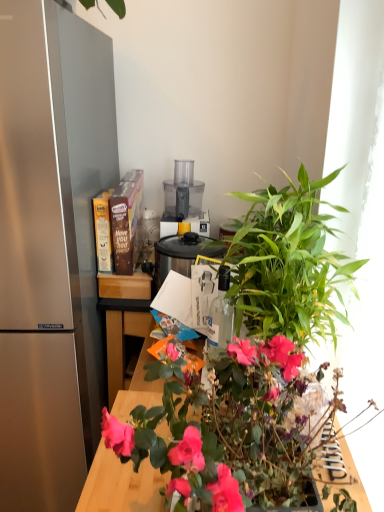
Image resolution: width=384 pixels, height=512 pixels. I want to click on satin silver blender at center, placed as the second appliance when sorted from bottom to top, so click(150, 227).

Describe the element at coordinates (181, 255) in the screenshot. I see `black plastic slow cooker at center, the 1th appliance when ordered from bottom to top` at that location.

Measure the distance between transparent glass bottle at center and camera.

The distance of transparent glass bottle at center from camera is 1.07 meters.

The height and width of the screenshot is (512, 384). What do you see at coordinates (183, 201) in the screenshot?
I see `transparent plastic food processor at center, the third appliance when ordered from bottom to top` at bounding box center [183, 201].

Find the location of `green leafy plant at center`. green leafy plant at center is located at coordinates (256, 355).

The height and width of the screenshot is (512, 384). Find the location of `satin silver blender at center, the 2th appliance from the top`. satin silver blender at center, the 2th appliance from the top is located at coordinates (150, 227).

Considering the positions of objects transparent glass bottle at center and black plastic slow cooker at center, the 1th appliance when ordered from bottom to top, in the image provided, who is more to the left, transparent glass bottle at center or black plastic slow cooker at center, the 1th appliance when ordered from bottom to top,?

From the viewer's perspective, black plastic slow cooker at center, the 1th appliance when ordered from bottom to top, appears more on the left side.

Would you say transparent glass bottle at center is a long distance from black plastic slow cooker at center, which is counted as the 3th appliance, starting from the top?

transparent glass bottle at center is actually quite close to black plastic slow cooker at center, which is counted as the 3th appliance, starting from the top.

Starting from the transparent glass bottle at center, which appliance is the 2nd one to the left? Please provide its 2D coordinates.

[(181, 255)]

From the picture: From the image's perspective, is transparent glass bottle at center beneath black plastic slow cooker at center, which is counted as the 3th appliance, starting from the top?

Yes, from the image's perspective, transparent glass bottle at center is beneath black plastic slow cooker at center, which is counted as the 3th appliance, starting from the top.

From the image's perspective, relative to black plastic slow cooker at center, which is counted as the 3th appliance, starting from the top, is satin silver refrigerator at left above or below?

satin silver refrigerator at left is below black plastic slow cooker at center, which is counted as the 3th appliance, starting from the top.

Is satin silver refrigerator at left closer to the viewer compared to black plastic slow cooker at center, the 1th appliance when ordered from bottom to top?

Yes, satin silver refrigerator at left is closer to the camera.

Is satin silver refrigerator at left positioned far away from black plastic slow cooker at center, which is counted as the 3th appliance, starting from the top?

No.

Between point (11, 57) and point (181, 260), which one is positioned behind?

The point (181, 260) is farther.

Is black plastic slow cooker at center, the 1th appliance when ordered from bottom to top, taller than satin silver blender at center, the 2th appliance from the top?

Yes.

From a real-world perspective, is black plastic slow cooker at center, the 1th appliance when ordered from bottom to top, below satin silver blender at center, placed as the second appliance when sorted from bottom to top?

Indeed, from a real-world perspective, black plastic slow cooker at center, the 1th appliance when ordered from bottom to top, is positioned beneath satin silver blender at center, placed as the second appliance when sorted from bottom to top.

Between black plastic slow cooker at center, the 1th appliance when ordered from bottom to top, and satin silver blender at center, placed as the second appliance when sorted from bottom to top, which one appears on the right side from the viewer's perspective?

black plastic slow cooker at center, the 1th appliance when ordered from bottom to top, is more to the right.

Is satin silver blender at center, the 2th appliance from the top, completely or partially inside black plastic slow cooker at center, the 1th appliance when ordered from bottom to top?

That's incorrect, satin silver blender at center, the 2th appliance from the top, is not inside black plastic slow cooker at center, the 1th appliance when ordered from bottom to top.

Does transparent plastic food processor at center, marked as the 1th appliance in a top-to-bottom arrangement, turn towards satin silver refrigerator at left?

No, transparent plastic food processor at center, marked as the 1th appliance in a top-to-bottom arrangement, is not aimed at satin silver refrigerator at left.

Is transparent plastic food processor at center, marked as the 1th appliance in a top-to-bottom arrangement, wider than satin silver refrigerator at left?

No.

Are transparent plastic food processor at center, marked as the 1th appliance in a top-to-bottom arrangement, and satin silver refrigerator at left located far from each other?

No, there isn't a large distance between transparent plastic food processor at center, marked as the 1th appliance in a top-to-bottom arrangement, and satin silver refrigerator at left.

Can you confirm if transparent plastic food processor at center, marked as the 1th appliance in a top-to-bottom arrangement, is bigger than satin silver refrigerator at left?

Actually, transparent plastic food processor at center, marked as the 1th appliance in a top-to-bottom arrangement, might be smaller than satin silver refrigerator at left.

This screenshot has height=512, width=384. I want to click on appliance that is the 1st object located above the satin silver refrigerator at left (from the image's perspective), so click(x=181, y=255).

From the picture: Could you measure the distance between black plastic slow cooker at center, which is counted as the 3th appliance, starting from the top, and satin silver refrigerator at left?

black plastic slow cooker at center, which is counted as the 3th appliance, starting from the top, and satin silver refrigerator at left are 46.22 centimeters apart.

Is black plastic slow cooker at center, the 1th appliance when ordered from bottom to top, not near satin silver refrigerator at left?

No, black plastic slow cooker at center, the 1th appliance when ordered from bottom to top, is not far from satin silver refrigerator at left.

Looking at their sizes, would you say black plastic slow cooker at center, the 1th appliance when ordered from bottom to top, is wider or thinner than satin silver refrigerator at left?

Clearly, black plastic slow cooker at center, the 1th appliance when ordered from bottom to top, has less width compared to satin silver refrigerator at left.

From the picture: Is transparent plastic food processor at center, the third appliance when ordered from bottom to top, positioned far away from green leafy plant at center-right?

That's not correct — transparent plastic food processor at center, the third appliance when ordered from bottom to top, is a little close to green leafy plant at center-right.

Does transparent plastic food processor at center, marked as the 1th appliance in a top-to-bottom arrangement, have a greater width compared to green leafy plant at center-right?

Incorrect, the width of transparent plastic food processor at center, marked as the 1th appliance in a top-to-bottom arrangement, does not surpass that of green leafy plant at center-right.

Between point (168, 229) and point (268, 263), which one is positioned in front?

The point (268, 263) is more forward.

In terms of height, does transparent plastic food processor at center, the third appliance when ordered from bottom to top, look taller or shorter compared to green leafy plant at center-right?

transparent plastic food processor at center, the third appliance when ordered from bottom to top, is shorter than green leafy plant at center-right.

Considering the sizes of black plastic slow cooker at center, which is counted as the 3th appliance, starting from the top, and transparent plastic food processor at center, the third appliance when ordered from bottom to top, in the image, is black plastic slow cooker at center, which is counted as the 3th appliance, starting from the top, wider or thinner than transparent plastic food processor at center, the third appliance when ordered from bottom to top,?

Clearly, black plastic slow cooker at center, which is counted as the 3th appliance, starting from the top, has less width compared to transparent plastic food processor at center, the third appliance when ordered from bottom to top.

Is transparent plastic food processor at center, the third appliance when ordered from bottom to top, completely or partially inside black plastic slow cooker at center, the 1th appliance when ordered from bottom to top?

No, transparent plastic food processor at center, the third appliance when ordered from bottom to top, is not inside black plastic slow cooker at center, the 1th appliance when ordered from bottom to top.

Is black plastic slow cooker at center, which is counted as the 3th appliance, starting from the top, not close to transparent plastic food processor at center, the third appliance when ordered from bottom to top?

No, there isn't a large distance between black plastic slow cooker at center, which is counted as the 3th appliance, starting from the top, and transparent plastic food processor at center, the third appliance when ordered from bottom to top.

From a real-world perspective, is black plastic slow cooker at center, which is counted as the 3th appliance, starting from the top, above or below transparent plastic food processor at center, marked as the 1th appliance in a top-to-bottom arrangement?

In terms of real-world spatial position, black plastic slow cooker at center, which is counted as the 3th appliance, starting from the top, is below transparent plastic food processor at center, marked as the 1th appliance in a top-to-bottom arrangement.

You are a GUI agent. You are given a task and a screenshot of the screen. Output one action in this format:
    pyautogui.click(x=<x>, y=<y>)
    Task: Click on the bottle located in front of the black plastic slow cooker at center, the 1th appliance when ordered from bottom to top
    Image resolution: width=384 pixels, height=512 pixels.
    Given the screenshot: What is the action you would take?
    pyautogui.click(x=220, y=317)

At what (x,y) coordinates should I click in order to perform the action: click on refrigerator located on the left of black plastic slow cooker at center, the 1th appliance when ordered from bottom to top. Please return your answer as a coordinate pair (x, y). The height and width of the screenshot is (512, 384). Looking at the image, I should click on (50, 248).

Based on their spatial positions, is black plastic slow cooker at center, the 1th appliance when ordered from bottom to top, or green leafy plant at center closer to green leafy plant at center-right?

green leafy plant at center is closer to green leafy plant at center-right.

Based on their spatial positions, is satin silver refrigerator at left or satin silver blender at center, placed as the second appliance when sorted from bottom to top, closer to green leafy plant at center-right?

Based on the image, satin silver refrigerator at left appears to be nearer to green leafy plant at center-right.

Consider the image. Looking at the image, which one is located closer to satin silver blender at center, the 2th appliance from the top, green leafy plant at center or transparent plastic food processor at center, marked as the 1th appliance in a top-to-bottom arrangement?

transparent plastic food processor at center, marked as the 1th appliance in a top-to-bottom arrangement.

Looking at the image, which one is located closer to transparent plastic food processor at center, the third appliance when ordered from bottom to top, green leafy plant at center-right or transparent glass bottle at center?

transparent glass bottle at center is closer to transparent plastic food processor at center, the third appliance when ordered from bottom to top.

Looking at the image, which one is located further to transparent glass bottle at center, transparent plastic food processor at center, the third appliance when ordered from bottom to top, or green leafy plant at center?

transparent plastic food processor at center, the third appliance when ordered from bottom to top, is further to transparent glass bottle at center.

From the image, which object appears to be farther from transparent plastic food processor at center, marked as the 1th appliance in a top-to-bottom arrangement, black plastic slow cooker at center, the 1th appliance when ordered from bottom to top, or green leafy plant at center-right?

green leafy plant at center-right is positioned further to the anchor transparent plastic food processor at center, marked as the 1th appliance in a top-to-bottom arrangement.

Estimate the real-world distances between objects in this image. Which object is closer to satin silver blender at center, placed as the second appliance when sorted from bottom to top, satin silver refrigerator at left or transparent glass bottle at center?

satin silver refrigerator at left.

When comparing their distances from black plastic slow cooker at center, which is counted as the 3th appliance, starting from the top, does satin silver blender at center, the 2th appliance from the top, or green leafy plant at center-right seem closer?

green leafy plant at center-right.

The image size is (384, 512). What are the coordinates of `vegetation located between green leafy plant at center and satin silver blender at center, placed as the second appliance when sorted from bottom to top, in the depth direction` in the screenshot? It's located at (288, 264).

Identify the location of appliance between green leafy plant at center-right and transparent plastic food processor at center, the third appliance when ordered from bottom to top, along the z-axis. The height and width of the screenshot is (512, 384). (181, 255).

Where is `houseplant located between satin silver refrigerator at left and green leafy plant at center-right in the left-right direction`? houseplant located between satin silver refrigerator at left and green leafy plant at center-right in the left-right direction is located at coordinates (256, 355).

The image size is (384, 512). I want to click on bottle between green leafy plant at center and satin silver blender at center, placed as the second appliance when sorted from bottom to top, in the front-back direction, so click(x=220, y=317).